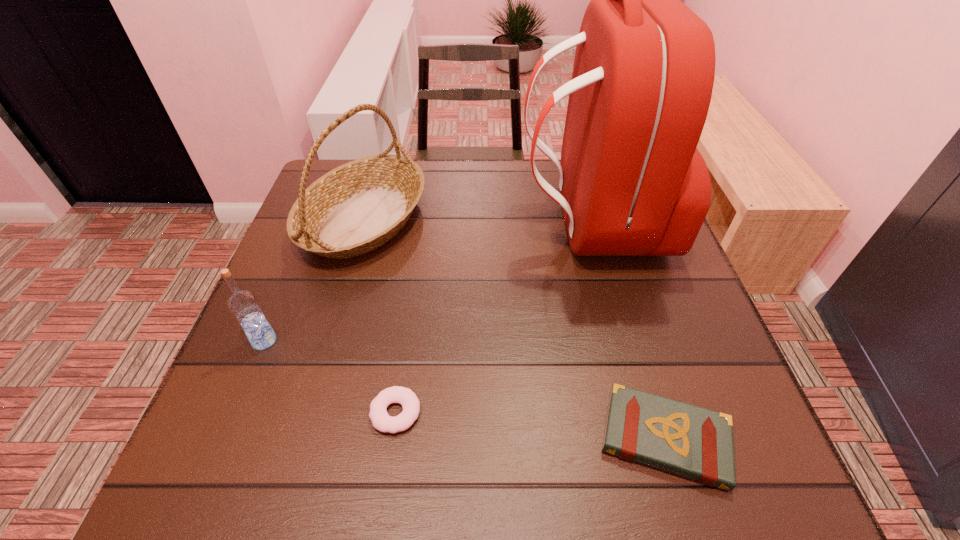
Find the location of `vacant space located on the right of the third tallest object`. vacant space located on the right of the third tallest object is located at coordinates (333, 341).

I want to click on free region located 0.160m on the back of the fourth tallest object, so click(630, 320).

This screenshot has width=960, height=540. Find the location of `vacant region located 0.360m on the back of the doughnut`. vacant region located 0.360m on the back of the doughnut is located at coordinates coord(419,252).

This screenshot has width=960, height=540. What are the coordinates of `backpack at the far edge` in the screenshot? It's located at (632, 183).

Find the location of `basket that is at the far edge`. basket that is at the far edge is located at coordinates (357, 207).

Identify the location of object located at the near edge. (693, 442).

Find the location of a particular element. basket present at the left edge is located at coordinates (357, 207).

You are a GUI agent. You are given a task and a screenshot of the screen. Output one action in this format:
    pyautogui.click(x=<x>, y=<y>)
    Task: Click on the vodka that is at the left edge
    
    Given the screenshot: What is the action you would take?
    pyautogui.click(x=243, y=304)

Where is `backpack at the right edge`? The height and width of the screenshot is (540, 960). backpack at the right edge is located at coordinates (632, 183).

Identify the location of book that is at the right edge. (693, 442).